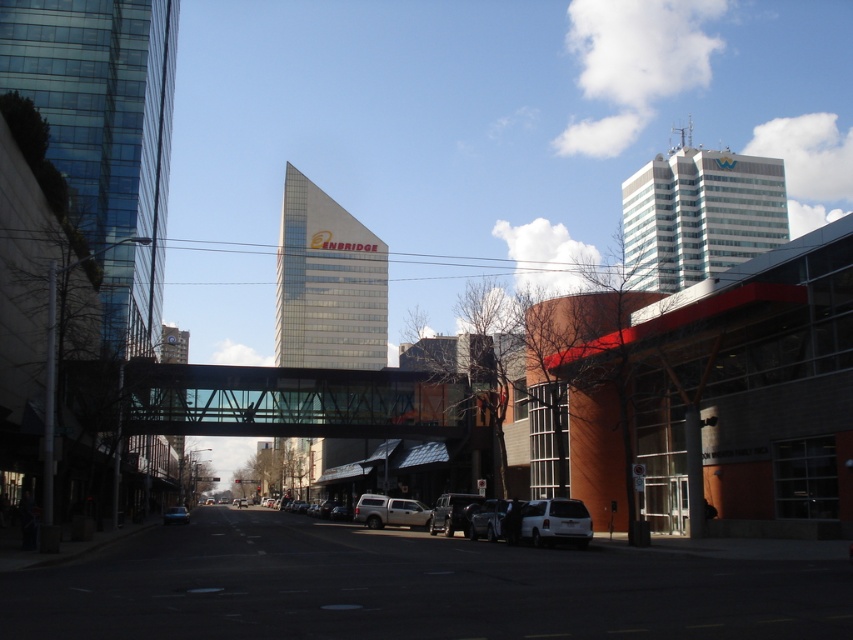
You are a delivery driver who needs to park your vehicle between two other vehicles in the street. You see a silver metallic truck at center and a metallic silver suv at center. Which vehicle should you park behind to ensure your vehicle fits properly?

You should park behind the metallic silver suv at center because it is taller than the silver metallic truck at center, providing more space for your vehicle to fit properly.